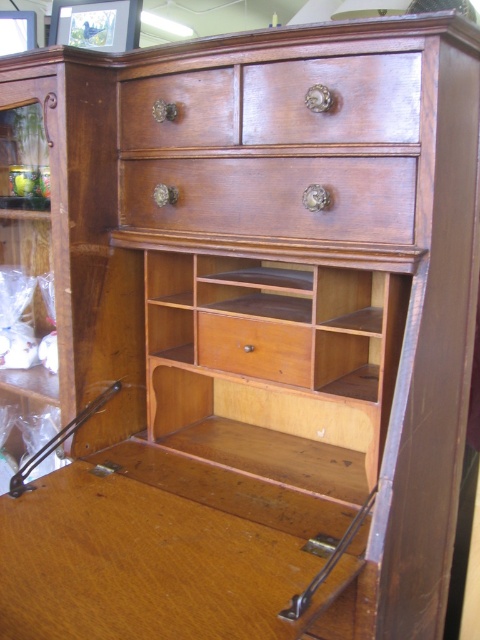
Question: Does wooden desk at center appear on the left side of polished wood drawer at center?

Choices:
 (A) no
 (B) yes

Answer: (B)

Question: Among these objects, which one is nearest to the camera?

Choices:
 (A) wooden drawer at center
 (B) wooden desk at center
 (C) matte wood drawer at upper center

Answer: (B)

Question: Which of the following is the farthest from the observer?

Choices:
 (A) (113, 499)
 (B) (222, 129)
 (C) (240, 208)

Answer: (A)

Question: Does polished wood drawer at center lie in front of matte wood drawer at upper center?

Choices:
 (A) no
 (B) yes

Answer: (B)

Question: Can you confirm if polished wood drawer at center is wider than matte wood drawer at upper center?

Choices:
 (A) yes
 (B) no

Answer: (A)

Question: Which object appears closest to the camera in this image?

Choices:
 (A) wooden drawer at center
 (B) polished wood drawer at center

Answer: (B)